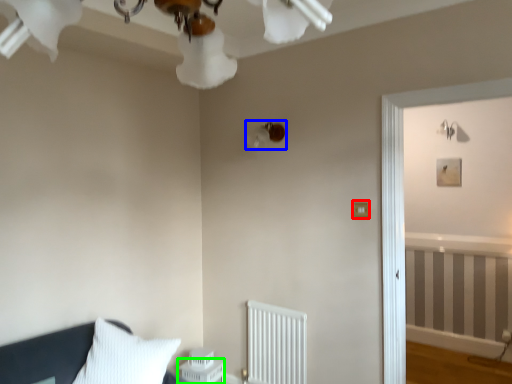
Question: Which object is the farthest from light switch (highlighted by a red box)? Choose among these: lamp (highlighted by a blue box) or table (highlighted by a green box).

Choices:
 (A) lamp
 (B) table

Answer: (B)